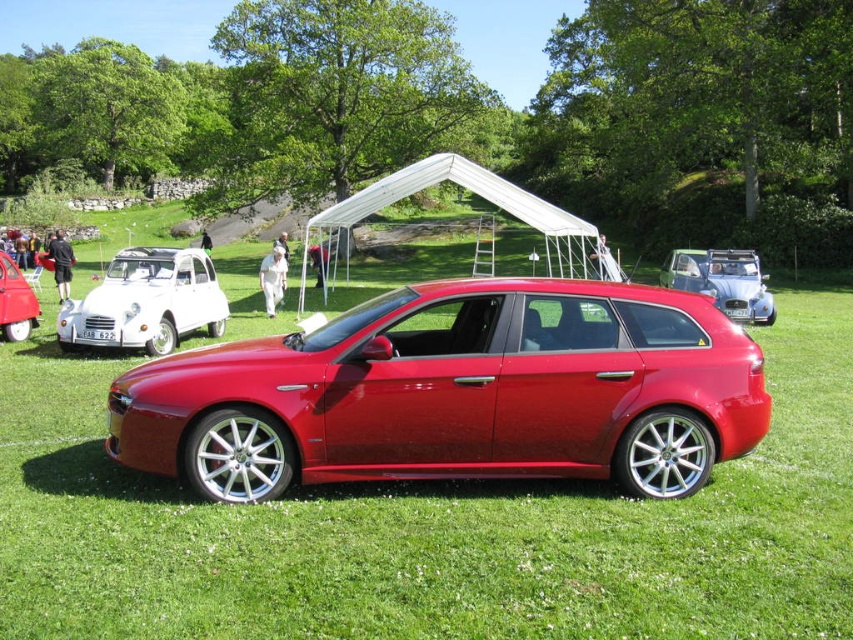
Question: Is glossy metallic car at center closer to camera compared to matte silver car at center?

Choices:
 (A) no
 (B) yes

Answer: (B)

Question: Which of these objects is positioned farthest from the glossy metallic car at center?

Choices:
 (A) white glossy vintage car at left
 (B) black fabric jacket at center
 (C) light brown leather jacket at center
 (D) metallic silver car at left

Answer: (C)

Question: Is white glossy vintage car at left closer to the viewer compared to light brown leather jacket at center?

Choices:
 (A) no
 (B) yes

Answer: (B)

Question: Which point is closer to the camera?

Choices:
 (A) (57, 230)
 (B) (404, 412)
 (C) (614, 262)
 (D) (677, 259)

Answer: (B)

Question: Which object appears closest to the camera in this image?

Choices:
 (A) metallic silver car at left
 (B) matte silver car at center
 (C) white cloth at center
 (D) glossy metallic car at center

Answer: (D)

Question: Can you confirm if glossy metallic car at center is bigger than white glossy vintage car at left?

Choices:
 (A) no
 (B) yes

Answer: (A)